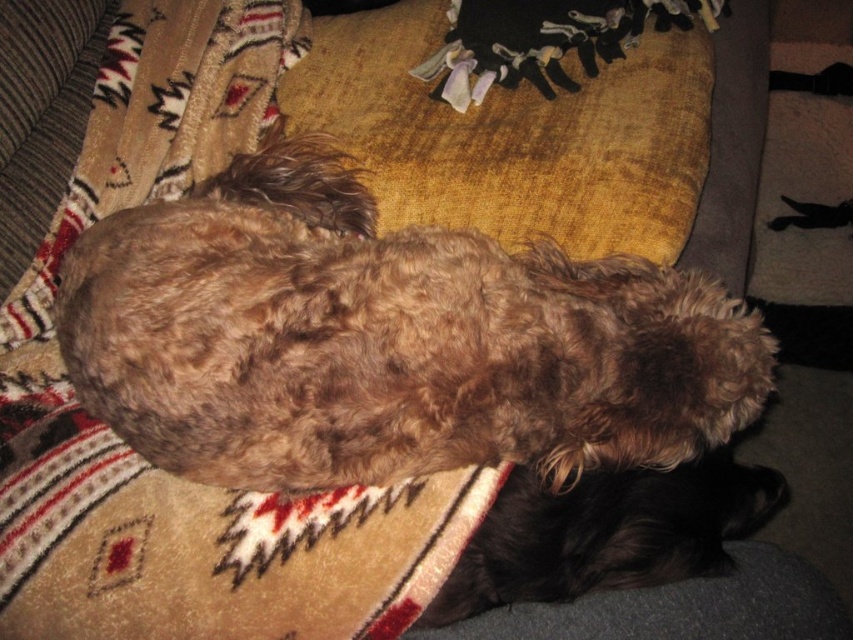
Is point (631, 422) positioned behind point (158, 540)?

No.

Can you confirm if brown fuzzy dog at center is taller than beige woven blanket at upper center?

Incorrect, brown fuzzy dog at center's height is not larger of beige woven blanket at upper center's.

Is point (190, 394) farther from viewer compared to point (306, 42)?

No, it is in front of (306, 42).

At what (x,y) coordinates should I click in order to perform the action: click on brown fuzzy dog at center. Please return your answer as a coordinate pair (x, y). The image size is (853, 640). Looking at the image, I should click on (387, 340).

How far apart are brown fuzzy dog at center and brown fuzzy dog at lower right?

The distance of brown fuzzy dog at center from brown fuzzy dog at lower right is 7.75 inches.

This screenshot has width=853, height=640. Find the location of `brown fuzzy dog at center`. brown fuzzy dog at center is located at coordinates (387, 340).

Where is `brown fuzzy dog at center`? The height and width of the screenshot is (640, 853). brown fuzzy dog at center is located at coordinates click(x=387, y=340).

Who is lower down, beige woven blanket at upper center or brown fuzzy dog at lower right?

Positioned lower is brown fuzzy dog at lower right.

Does beige woven blanket at upper center have a greater height compared to brown fuzzy dog at lower right?

Yes, beige woven blanket at upper center is taller than brown fuzzy dog at lower right.

This screenshot has width=853, height=640. Find the location of `beige woven blanket at upper center`. beige woven blanket at upper center is located at coordinates (143, 460).